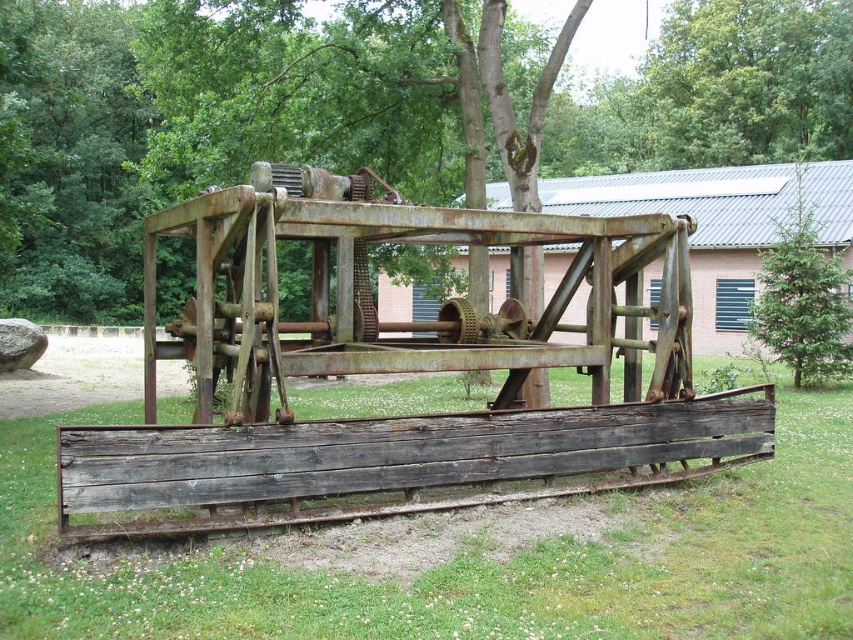
Describe the element at coordinates (465, 557) in the screenshot. I see `weathered wood at center` at that location.

Is point (610, 554) farther from viewer compared to point (849, 362)?

No.

In order to click on weathered wood at center in this screenshot , I will do `click(465, 557)`.

Does green leafy tree at upper center appear on the right side of green textured pine tree at center?

Indeed, green leafy tree at upper center is positioned on the right side of green textured pine tree at center.

Is point (764, 104) more distant than point (762, 250)?

Yes, point (764, 104) is farther from viewer.

Between point (773, 35) and point (834, 300), which one is positioned in front?

Positioned in front is point (834, 300).

This screenshot has width=853, height=640. I want to click on green leafy tree at upper center, so click(747, 81).

Does weathered wood at center appear under green leafy tree at upper center?

Correct, weathered wood at center is located below green leafy tree at upper center.

Does point (450, 522) come farther from viewer compared to point (723, 148)?

No, (450, 522) is in front of (723, 148).

Who is more forward, (x=407, y=624) or (x=805, y=141)?

Positioned in front is point (x=407, y=624).

Locate an element on the screen. The height and width of the screenshot is (640, 853). weathered wood at center is located at coordinates (465, 557).